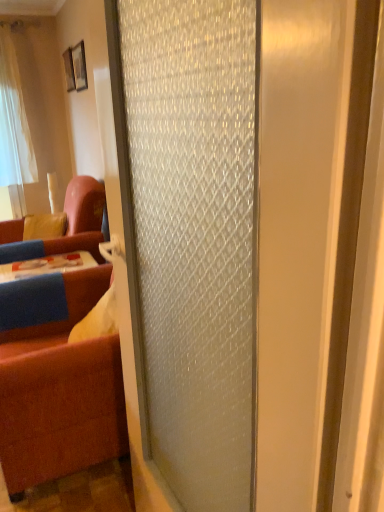
Question: Is brown fabric studio couch at left, the second studio couch in the back-to-front sequence, touching frosted glass door at center?

Choices:
 (A) yes
 (B) no

Answer: (B)

Question: Can you confirm if brown fabric studio couch at left, the second studio couch in the back-to-front sequence, is smaller than frosted glass door at center?

Choices:
 (A) no
 (B) yes

Answer: (A)

Question: Is brown fabric studio couch at left, which is counted as the 1th studio couch, starting from the front, not inside frosted glass door at center?

Choices:
 (A) yes
 (B) no

Answer: (A)

Question: Can you confirm if brown fabric studio couch at left, which is counted as the 1th studio couch, starting from the front, is positioned to the left of frosted glass door at center?

Choices:
 (A) no
 (B) yes

Answer: (B)

Question: Does brown fabric studio couch at left, which is counted as the 1th studio couch, starting from the front, appear on the right side of frosted glass door at center?

Choices:
 (A) yes
 (B) no

Answer: (B)

Question: From the image's perspective, is brown fabric studio couch at left, the second studio couch in the back-to-front sequence, below frosted glass door at center?

Choices:
 (A) no
 (B) yes

Answer: (B)

Question: Is velvet blue couch at left, acting as the first studio couch starting from the back, positioned in front of wooden picture frame at upper left, arranged as the first picture frame when viewed from the back?

Choices:
 (A) yes
 (B) no

Answer: (A)

Question: Does velvet blue couch at left, acting as the first studio couch starting from the back, have a lesser height compared to wooden picture frame at upper left, the 2th picture frame in the front-to-back sequence?

Choices:
 (A) no
 (B) yes

Answer: (A)

Question: Is velvet blue couch at left, acting as the first studio couch starting from the back, thinner than wooden picture frame at upper left, the 2th picture frame in the front-to-back sequence?

Choices:
 (A) no
 (B) yes

Answer: (A)

Question: Does velvet blue couch at left, which is counted as the 2th studio couch, starting from the front, appear on the right side of wooden picture frame at upper left, the second picture frame when ordered from right to left?

Choices:
 (A) yes
 (B) no

Answer: (A)

Question: Can you confirm if velvet blue couch at left, acting as the first studio couch starting from the back, is wider than wooden picture frame at upper left, the 2th picture frame in the front-to-back sequence?

Choices:
 (A) yes
 (B) no

Answer: (A)

Question: Is velvet blue couch at left, acting as the first studio couch starting from the back, at the left side of wooden picture frame at upper left, the 2th picture frame in the front-to-back sequence?

Choices:
 (A) no
 (B) yes

Answer: (A)

Question: Considering the relative sizes of brown fabric studio couch at left, the second studio couch in the back-to-front sequence, and wooden picture frame at upper left, marked as the 1th picture frame in a front-to-back arrangement, in the image provided, is brown fabric studio couch at left, the second studio couch in the back-to-front sequence, wider than wooden picture frame at upper left, marked as the 1th picture frame in a front-to-back arrangement,?

Choices:
 (A) no
 (B) yes

Answer: (B)